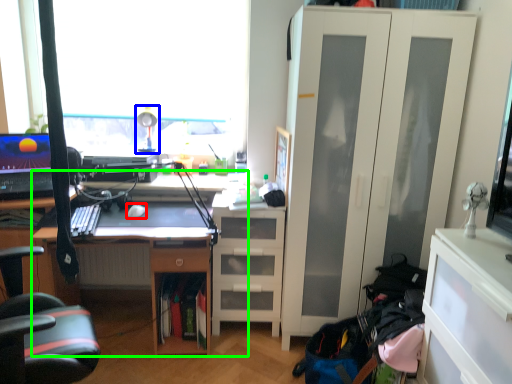
Question: Considering the real-world distances, which object is closest to mouse (highlighted by a red box)? table lamp (highlighted by a blue box) or desk (highlighted by a green box).

Choices:
 (A) table lamp
 (B) desk

Answer: (B)